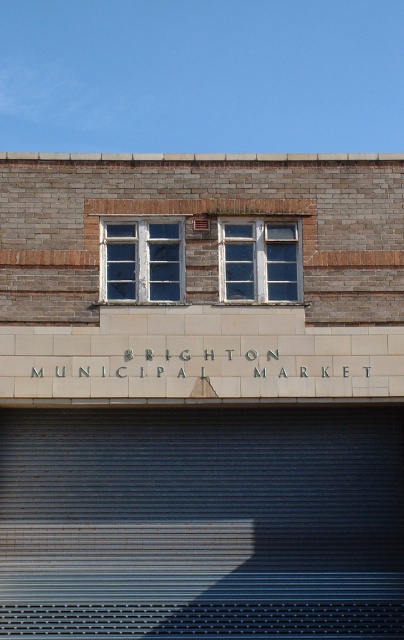
Question: Which of the following is the farthest from the observer?

Choices:
 (A) white tile sign at center
 (B) metallic gray garage door at bottom
 (C) blue glass window at upper center

Answer: (C)

Question: In this image, where is white tile sign at center located relative to white wooden window at upper center?

Choices:
 (A) right
 (B) left

Answer: (A)

Question: Which point is closer to the camera taking this photo?

Choices:
 (A) (319, 364)
 (B) (86, 582)

Answer: (A)

Question: Can you confirm if metallic gray garage door at bottom is positioned below blue glass window at upper center?

Choices:
 (A) yes
 (B) no

Answer: (A)

Question: Does metallic gray garage door at bottom appear on the left side of white wooden window at upper center?

Choices:
 (A) no
 (B) yes

Answer: (A)

Question: Among these objects, which one is farthest from the camera?

Choices:
 (A) metallic gray garage door at bottom
 (B) white tile sign at center

Answer: (B)